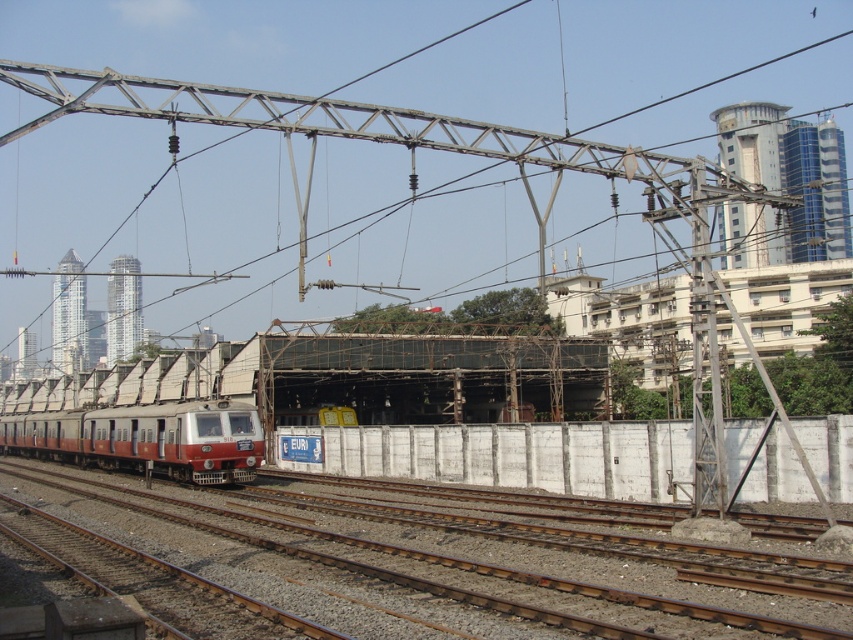
Question: Is brown gravel train track at center positioned at the back of red matte train at lower left?

Choices:
 (A) yes
 (B) no

Answer: (B)

Question: Does brown gravel train track at center have a smaller size compared to red matte train at lower left?

Choices:
 (A) yes
 (B) no

Answer: (A)

Question: Does brown gravel train track at center appear under red matte train at lower left?

Choices:
 (A) yes
 (B) no

Answer: (B)

Question: Which point is farther from the camera taking this photo?

Choices:
 (A) (112, 432)
 (B) (322, 611)

Answer: (A)